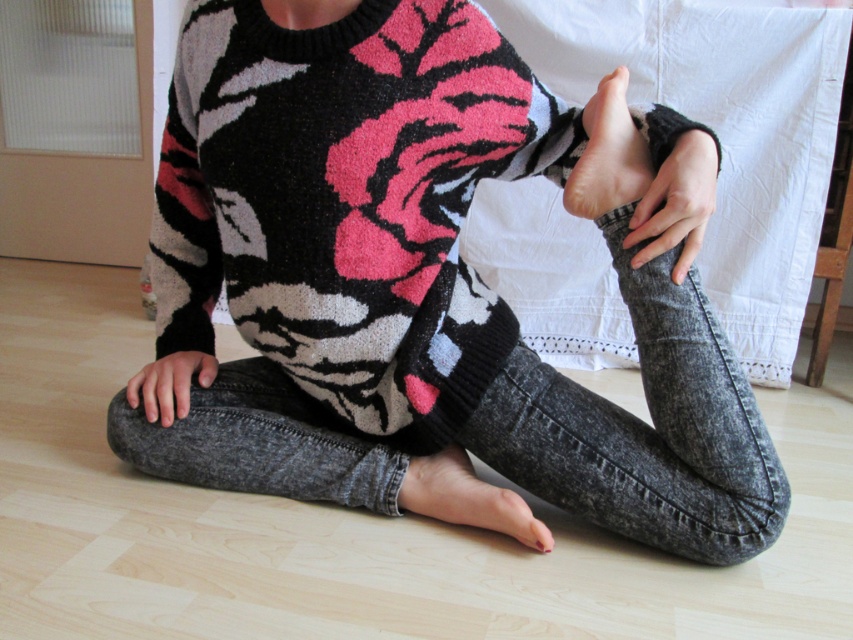
Between point (227, 442) and point (138, 381), which one is positioned behind?

Positioned behind is point (138, 381).

Can you confirm if knit sweater at center is positioned to the left of gray matte hand at lower left?

In fact, knit sweater at center is to the right of gray matte hand at lower left.

Where is `knit sweater at center`? The height and width of the screenshot is (640, 853). knit sweater at center is located at coordinates (x=412, y=285).

This screenshot has width=853, height=640. Describe the element at coordinates (608, 154) in the screenshot. I see `pink matte foot at center` at that location.

Measure the distance between point (583, 209) and camera.

They are 37.21 inches apart.

Between point (595, 163) and point (183, 353), which one is positioned behind?

Point (183, 353)

I want to click on pink matte foot at center, so click(x=608, y=154).

Does smooth skin hand at center appear on the left side of gray matte hand at lower left?

In fact, smooth skin hand at center is to the right of gray matte hand at lower left.

Is smooth skin hand at center above gray matte hand at lower left?

Correct, smooth skin hand at center is located above gray matte hand at lower left.

Who is more forward, [650,196] or [183,385]?

Point [650,196]

At what (x,y) coordinates should I click in order to perform the action: click on smooth skin hand at center. Please return your answer as a coordinate pair (x, y). This screenshot has height=640, width=853. Looking at the image, I should click on (676, 202).